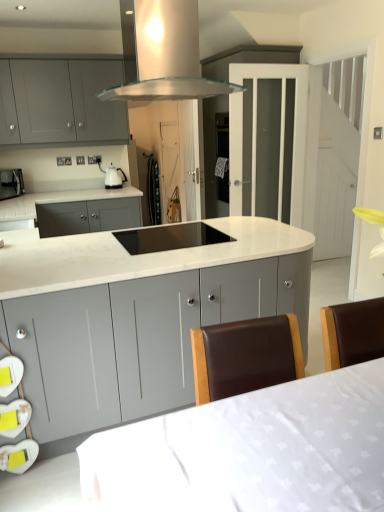
Question: From the image's perspective, is matte gray cabinets at upper left, which appears as the 2th cabinetry when viewed from the front, beneath transparent glass range hood at upper center?

Choices:
 (A) no
 (B) yes

Answer: (A)

Question: From a real-world perspective, is matte gray cabinets at upper left, the 1th cabinetry positioned from the back, on transparent glass range hood at upper center?

Choices:
 (A) yes
 (B) no

Answer: (B)

Question: From the image's perspective, is matte gray cabinets at upper left, arranged as the first cabinetry when viewed from the top, located above transparent glass range hood at upper center?

Choices:
 (A) yes
 (B) no

Answer: (A)

Question: Is matte gray cabinets at upper left, the second cabinetry ordered from the bottom, far from transparent glass range hood at upper center?

Choices:
 (A) no
 (B) yes

Answer: (B)

Question: Is matte gray cabinets at upper left, which appears as the 2th cabinetry when viewed from the front, positioned behind transparent glass range hood at upper center?

Choices:
 (A) no
 (B) yes

Answer: (B)

Question: Is point (115, 88) closer or farther from the camera than point (130, 237)?

Choices:
 (A) closer
 (B) farther

Answer: (B)

Question: Do you think transparent glass range hood at upper center is within black glass cooktop at center, or outside of it?

Choices:
 (A) inside
 (B) outside

Answer: (B)

Question: Looking at the image, does transparent glass range hood at upper center seem bigger or smaller compared to black glass cooktop at center?

Choices:
 (A) big
 (B) small

Answer: (A)

Question: Is transparent glass range hood at upper center to the left or to the right of black glass cooktop at center in the image?

Choices:
 (A) right
 (B) left

Answer: (B)

Question: Is matte gray cabinets at upper left, which appears as the 2th cabinetry when viewed from the front, bigger or smaller than matte black microwave at left?

Choices:
 (A) big
 (B) small

Answer: (A)

Question: Considering their positions, is matte gray cabinets at upper left, the second cabinetry ordered from the bottom, located in front of or behind matte black microwave at left?

Choices:
 (A) front
 (B) behind

Answer: (A)

Question: Is matte gray cabinets at upper left, which appears as the 2th cabinetry when viewed from the front, taller or shorter than matte black microwave at left?

Choices:
 (A) tall
 (B) short

Answer: (A)

Question: From the image's perspective, relative to matte black microwave at left, is matte gray cabinets at upper left, the second cabinetry ordered from the bottom, above or below?

Choices:
 (A) above
 (B) below

Answer: (A)

Question: Considering the positions of white marble countertop at center and matte gray cabinets at upper left, which appears as the 2th cabinetry when viewed from the front, in the image, is white marble countertop at center wider or thinner than matte gray cabinets at upper left, which appears as the 2th cabinetry when viewed from the front,?

Choices:
 (A) thin
 (B) wide

Answer: (B)

Question: Considering the relative positions of white marble countertop at center and matte gray cabinets at upper left, arranged as the first cabinetry when viewed from the top, in the image provided, is white marble countertop at center to the left or to the right of matte gray cabinets at upper left, arranged as the first cabinetry when viewed from the top,?

Choices:
 (A) left
 (B) right

Answer: (B)